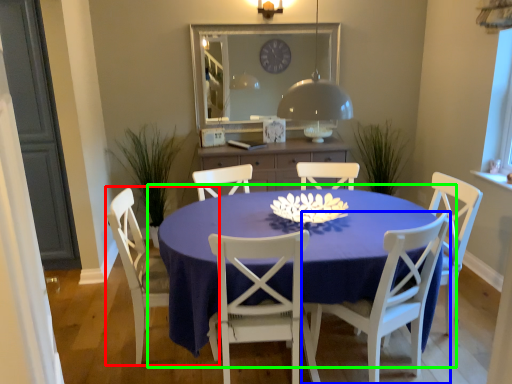
Question: Which is farther away from chair (highlighted by a red box)? chair (highlighted by a blue box) or kitchen & dining room table (highlighted by a green box)?

Choices:
 (A) chair
 (B) kitchen & dining room table

Answer: (A)